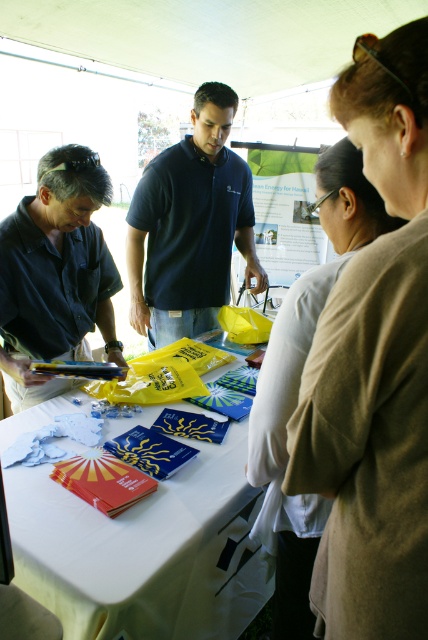
Which of these two, dark blue polo shirt at center or light beige sweater at center, stands shorter?

dark blue polo shirt at center

Where is `dark blue polo shirt at center`? dark blue polo shirt at center is located at coordinates (190, 225).

Where is `dark blue polo shirt at center`? dark blue polo shirt at center is located at coordinates (190, 225).

Is point (35, 477) less distant than point (273, 365)?

No, (35, 477) is further to viewer.

Which is below, white cloth table at center or light beige sweater at center?

white cloth table at center

Image resolution: width=428 pixels, height=640 pixels. I want to click on white cloth table at center, so click(x=145, y=552).

This screenshot has width=428, height=640. I want to click on white cloth table at center, so click(145, 552).

Between point (216, 547) and point (130, 232), which one is positioned in front?

Point (216, 547)

Based on the photo, which is above, white cloth table at center or dark blue polo shirt at center?

Positioned higher is dark blue polo shirt at center.

Does point (15, 561) come behind point (222, 264)?

No, (15, 561) is closer to viewer.

Identify the location of white cloth table at center. The height and width of the screenshot is (640, 428). (145, 552).